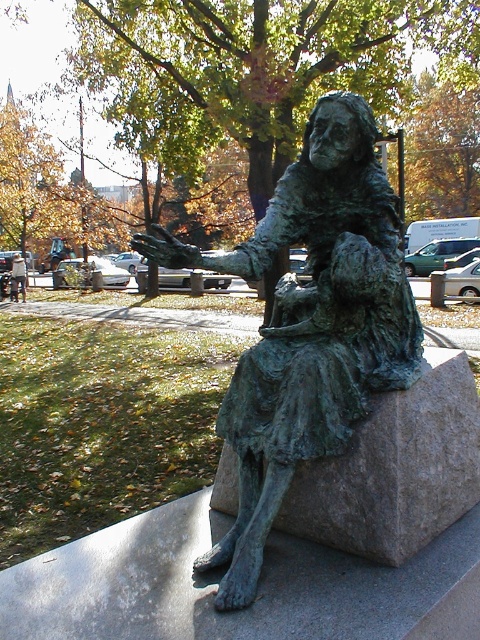
You are a city planner reviewing the layout of the park. The statue must be placed at coordinates between 0.5 and 0.6 on the x and y axes to align with the park design. Is the green patina bronze statue at center positioned correctly?

The green patina bronze statue at center is at point (310, 324), which falls within the required x and y coordinates between 0.5 and 0.6. Therefore, it is positioned correctly.

You are an art conservator assessing the bronze statue. You notice a specific point at coordinates (x=310, y=324) on the statue. What object is located at that point?

The green patina bronze statue at center is located at point (x=310, y=324).

You are standing in front of the statue and want to touch the green patina stone at center and the metallic gray statue at center. Which object will your hand reach first?

The green patina stone at center is closer to you than the metallic gray statue at center, so your hand will reach the green patina stone at center first.